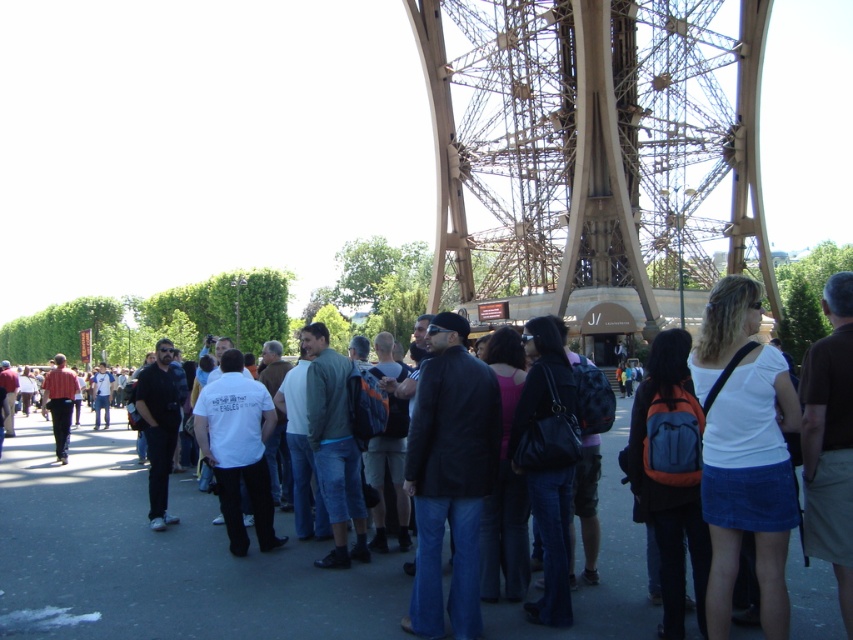
Between metallic brown structure at center and orange backpack at center, which one appears on the right side from the viewer's perspective?

From the viewer's perspective, orange backpack at center appears more on the right side.

Is metallic brown structure at center below orange backpack at center?

Incorrect, metallic brown structure at center is not positioned below orange backpack at center.

Locate an element on the screen. The width and height of the screenshot is (853, 640). metallic brown structure at center is located at coordinates (593, 144).

Is white cotton shirt at center bigger than orange backpack at center?

Yes, white cotton shirt at center is bigger than orange backpack at center.

Is white cotton shirt at center below orange backpack at center?

No, white cotton shirt at center is not below orange backpack at center.

Image resolution: width=853 pixels, height=640 pixels. In order to click on white cotton shirt at center in this screenshot , I will do `click(749, 486)`.

Identify the location of white cotton shirt at center. (749, 486).

Who is taller, metallic brown structure at center or white cotton shirt at center?

With more height is metallic brown structure at center.

Which of these two, metallic brown structure at center or white cotton shirt at center, stands shorter?

With less height is white cotton shirt at center.

Where is `metallic brown structure at center`? The height and width of the screenshot is (640, 853). metallic brown structure at center is located at coordinates (593, 144).